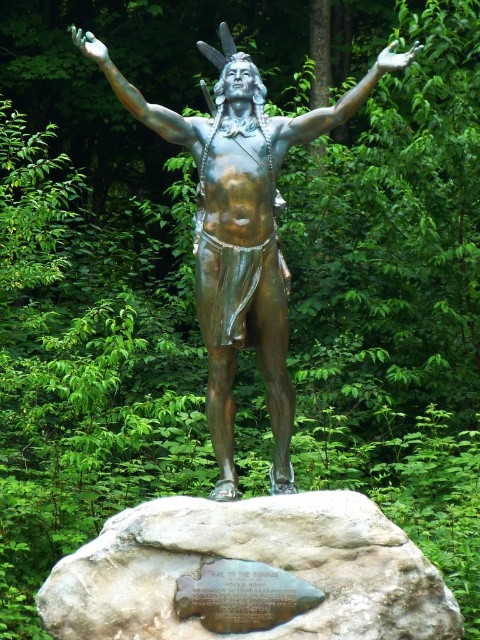
Question: Is bronze statue at center thinner than gray stone plaque at center?

Choices:
 (A) no
 (B) yes

Answer: (B)

Question: Which of the following is the farthest from the observer?

Choices:
 (A) (395, 42)
 (B) (74, 604)

Answer: (A)

Question: Is bronze statue at center wider than gray stone plaque at center?

Choices:
 (A) no
 (B) yes

Answer: (A)

Question: Is bronze statue at center thinner than gray stone plaque at center?

Choices:
 (A) no
 (B) yes

Answer: (B)